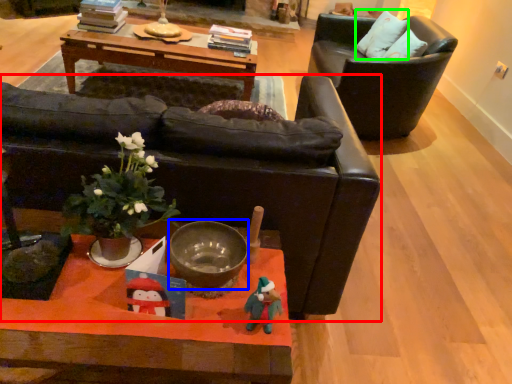
Question: Considering the real-world distances, which object is farthest from chair (highlighted by a red box)? bowl (highlighted by a blue box) or pillow (highlighted by a green box)?

Choices:
 (A) bowl
 (B) pillow

Answer: (B)